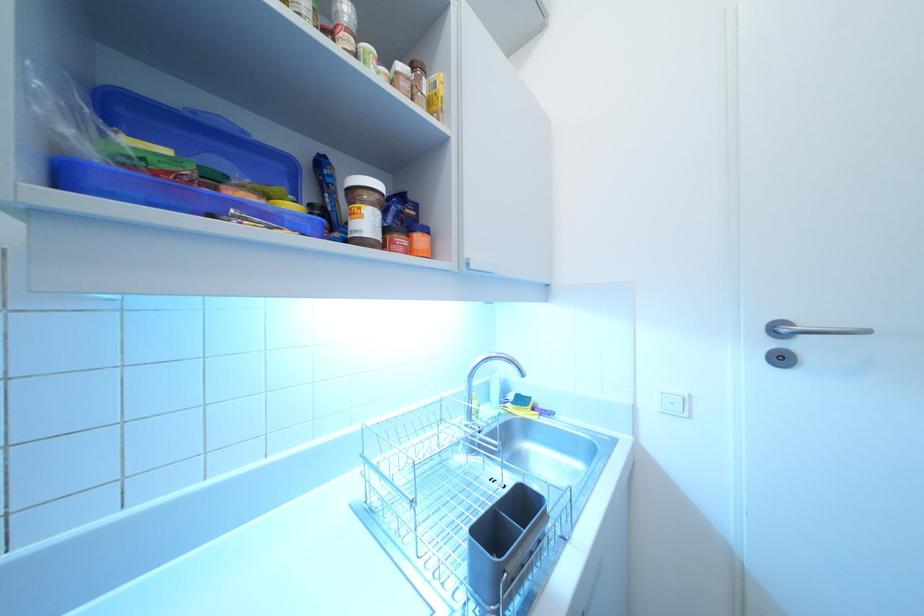
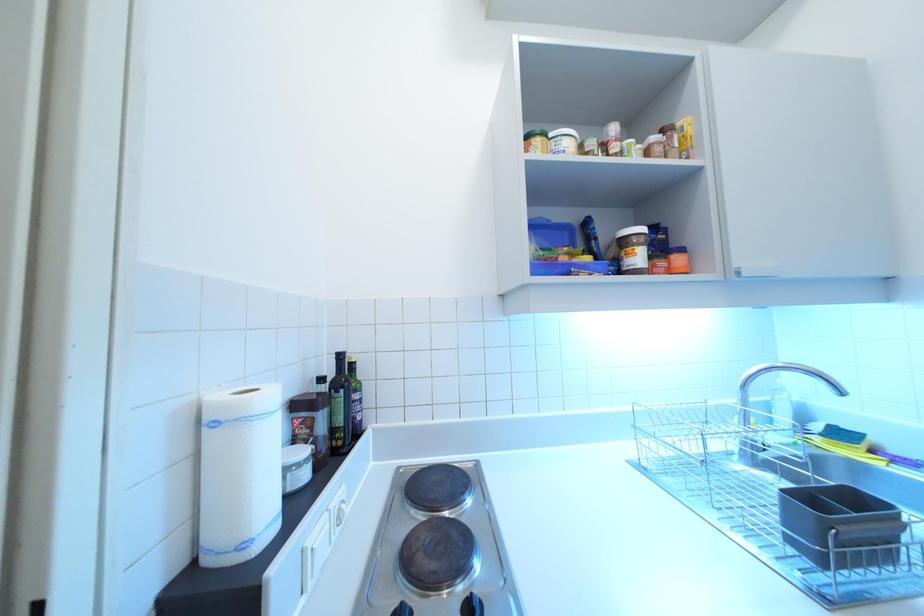
Question: Based on the continuous images, in which direction is the camera rotating? Reply with the corresponding letter.

Choices:
 (A) Left
 (B) Right
 (C) Up
 (D) Down

Answer: (A)